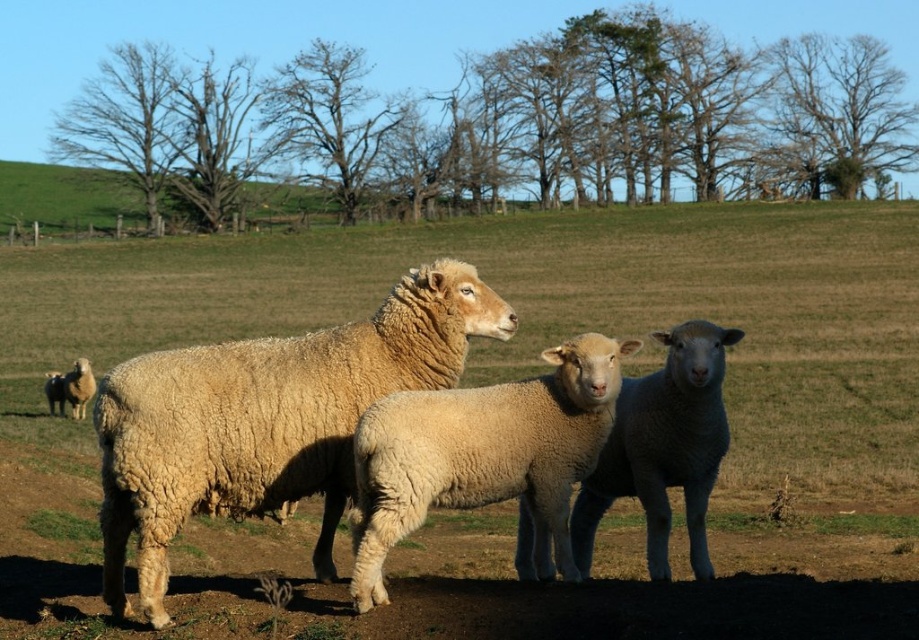
Question: Which point is farther to the camera?

Choices:
 (A) fuzzy woolen lamb at center
 (B) white woolen sheep at center
 (C) green soft grass at center
 (D) light brown woolly sheep at lower left

Answer: (D)

Question: Does golden woolen sheep at center have a lesser width compared to light brown woolly sheep at lower left?

Choices:
 (A) yes
 (B) no

Answer: (B)

Question: Is green soft grass at center wider than golden woolen sheep at center?

Choices:
 (A) no
 (B) yes

Answer: (B)

Question: Which point appears farthest from the camera in this image?

Choices:
 (A) (682, 388)
 (B) (304, 467)
 (C) (358, 538)
 (D) (94, 611)

Answer: (D)

Question: Observing the image, what is the correct spatial positioning of green soft grass at center in reference to golden woolen sheep at center?

Choices:
 (A) below
 (B) above

Answer: (B)

Question: Which point appears closest to the camera in this image?

Choices:
 (A) (53, 403)
 (B) (719, 243)
 (C) (144, 586)

Answer: (C)